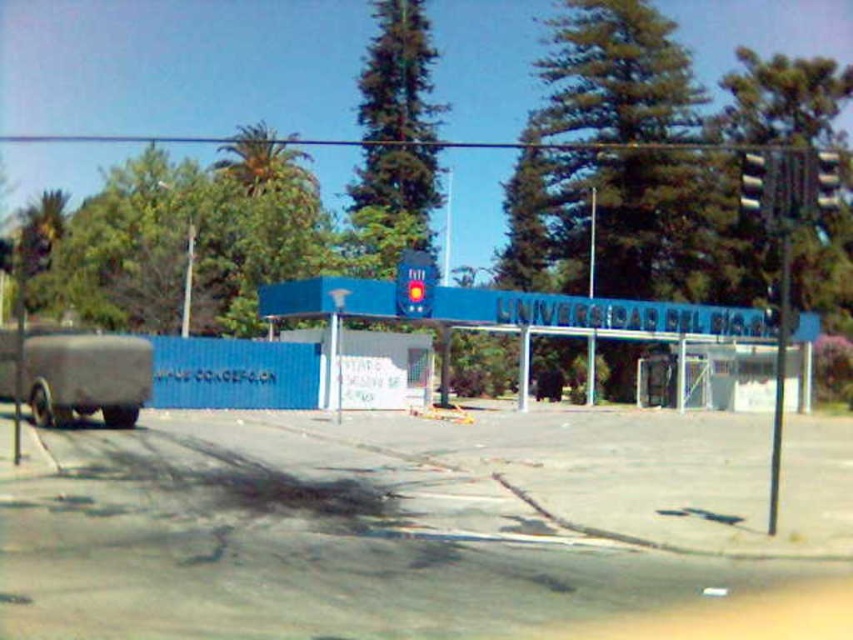
You are a delivery driver with a truck that is 23 meters long. You need to back up your truck into the parking lot behind the matte gray trailer at left and the metallic pole at center. Can your truck fit between them without touching either?

The distance between the matte gray trailer at left and the metallic pole at center is 25.22 meters. Since your truck is 23 meters long, it can fit between them as there is enough space.

You are a delivery driver approaching the Universidad del BIOException gate. You need to park your truck near the metallic pole at right and the metallic pole at center. Which pole should you park closer to if you want to avoid blocking the entrance pathway?

You should park closer to the metallic pole at right because it is larger in size than the metallic pole at center, so there is more space around it to park without obstructing the entrance pathway.